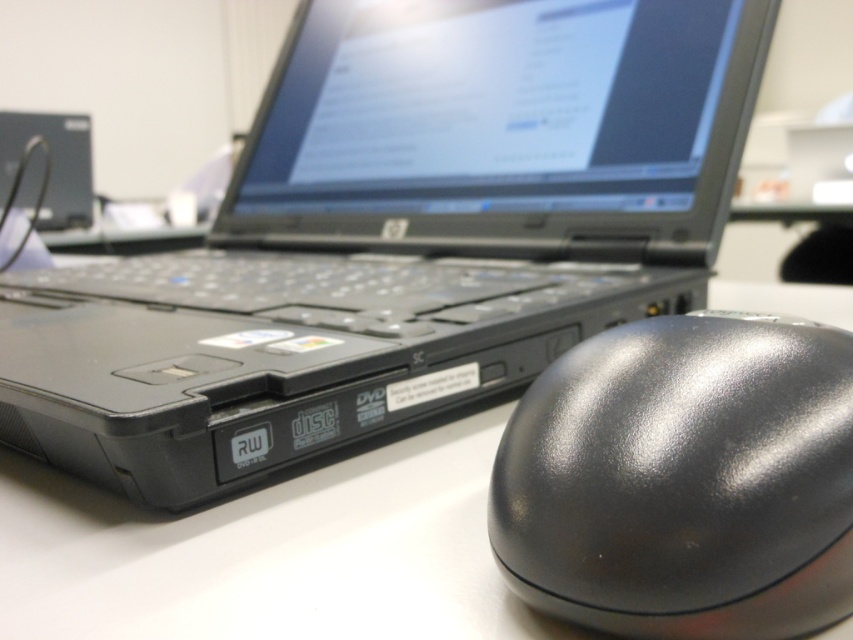
Question: Which object is farther from the camera taking this photo?

Choices:
 (A) black matte laptop at center
 (B) glossy black mouse at lower right

Answer: (A)

Question: Can you confirm if black matte laptop at center is thinner than white matte table at center?

Choices:
 (A) no
 (B) yes

Answer: (A)

Question: Which point appears farthest from the camera in this image?

Choices:
 (A) (445, 81)
 (B) (804, 552)
 (C) (200, 595)

Answer: (A)

Question: Is black matte laptop at center above white matte table at center?

Choices:
 (A) no
 (B) yes

Answer: (B)

Question: Is glossy black mouse at lower right positioned behind white matte table at center?

Choices:
 (A) yes
 (B) no

Answer: (B)

Question: Which point is closer to the camera?

Choices:
 (A) white matte table at center
 (B) black matte laptop at center

Answer: (A)